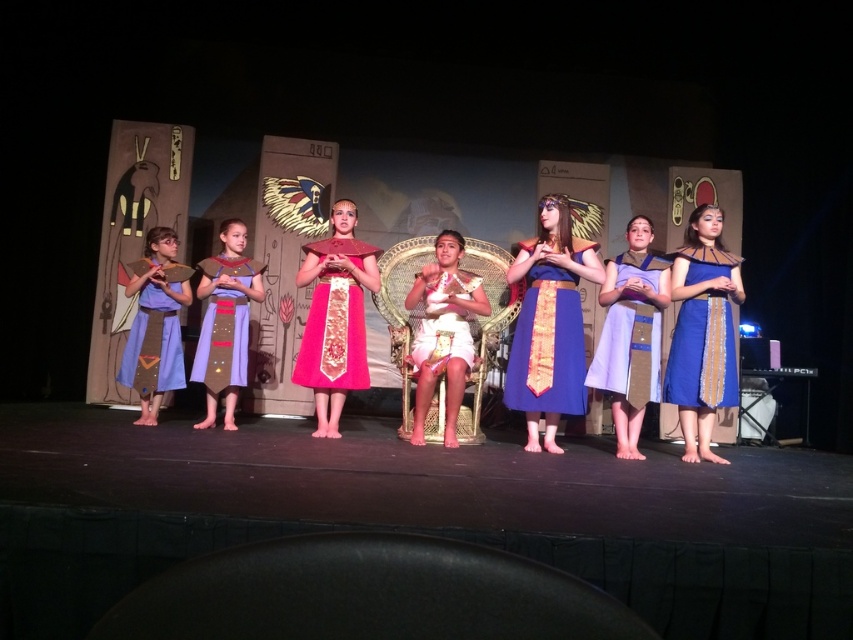
Describe the element at coordinates (444, 332) in the screenshot. This screenshot has width=853, height=640. I see `white silk dress at center` at that location.

Find the location of a particular element. The height and width of the screenshot is (640, 853). white silk dress at center is located at coordinates (444, 332).

Find the location of `white silk dress at center`. white silk dress at center is located at coordinates (444, 332).

Is point (573, 397) in front of point (317, 285)?

Yes, it is.

Image resolution: width=853 pixels, height=640 pixels. What do you see at coordinates (547, 346) in the screenshot? I see `blue satin dress at center` at bounding box center [547, 346].

The height and width of the screenshot is (640, 853). Identify the location of blue satin dress at center. (547, 346).

Does point (625, 312) lie in front of point (222, 358)?

Yes, point (625, 312) is in front of point (222, 358).

Is matte blue dress at center taller than matte purple fabric dress at center?

Correct, matte blue dress at center is much taller as matte purple fabric dress at center.

I want to click on matte blue dress at center, so click(x=628, y=349).

At what (x,y) coordinates should I click in order to perform the action: click on matte blue dress at center. Please return your answer as a coordinate pair (x, y). This screenshot has width=853, height=640. Looking at the image, I should click on (628, 349).